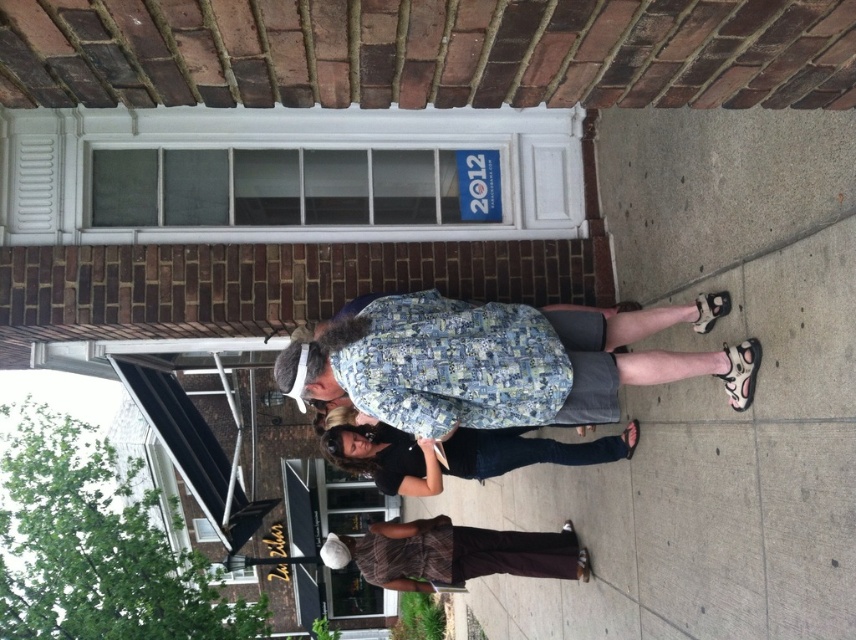
Question: In this image, where is patterned fabric jacket at center located relative to black denim jeans at center?

Choices:
 (A) right
 (B) left

Answer: (A)

Question: Among these objects, which one is farthest from the camera?

Choices:
 (A) patterned fabric jacket at center
 (B) black denim jeans at center

Answer: (B)

Question: Is patterned fabric jacket at center positioned in front of black denim jeans at center?

Choices:
 (A) no
 (B) yes

Answer: (B)

Question: Which object is farther from the camera taking this photo?

Choices:
 (A) patterned fabric jacket at center
 (B) black denim jeans at center

Answer: (B)

Question: Among these points, which one is farthest from the camera?

Choices:
 (A) (723, 364)
 (B) (413, 492)

Answer: (B)

Question: Observing the image, what is the correct spatial positioning of patterned fabric jacket at center in reference to black denim jeans at center?

Choices:
 (A) below
 (B) above

Answer: (B)